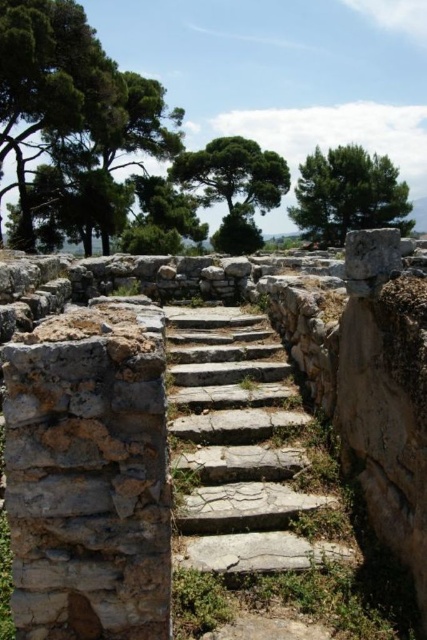
You are standing at the bottom of the natural stone stairs at center and want to reach the green leafy tree at upper right. Which object is taller when you look up from the stairs?

The green leafy tree at upper right is taller than the natural stone stairs at center.

You are a hiker planning to climb the natural stone stairs at center. You notice a green leafy tree at upper left nearby. Which object has a narrower width?

The natural stone stairs at center is thinner than the green leafy tree at upper left, so the natural stone stairs at center has a narrower width.

You are standing at the base of the ancient stone structure. You see the point marked at coordinates (239, 445). What does this point represent in the scene?

The point at coordinates (239, 445) represents the natural stone stairs at center.